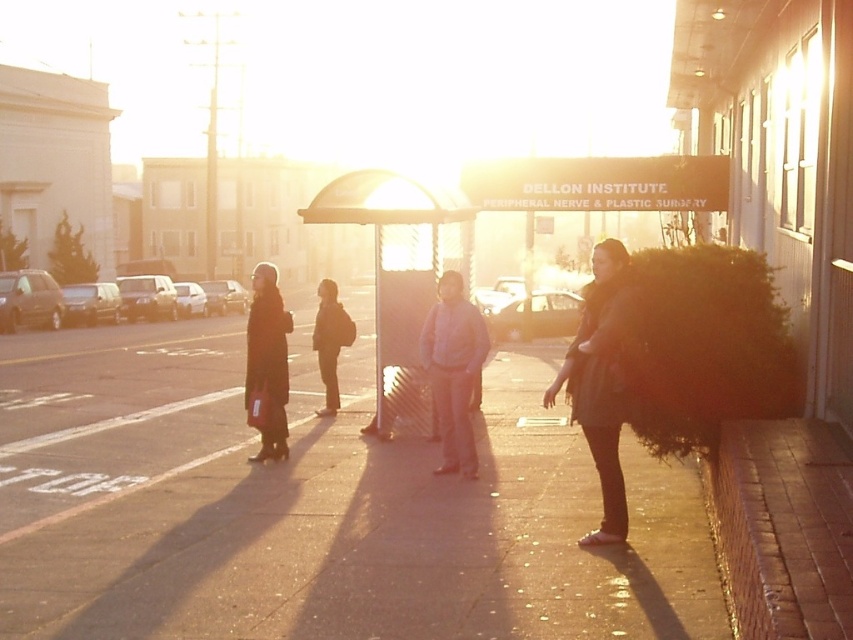
Consider the image. You are a delivery person needing to place a package on the smooth concrete sidewalk at center. The delivery point is marked by coordinates point [315,506]. Is the package within the shelter area?

The point [315,506] marks the smooth concrete sidewalk at center, which is not under the shelter area. The shelter is near the building with the DELLON INSTITUTE sign, so the package placed at this point would be outside the shelter.

You are a delivery person who needs to place a package on the sidewalk at point (601, 381). Is there an object at that location?

Yes, the dark brown fur coat at right is located at point (601, 381).